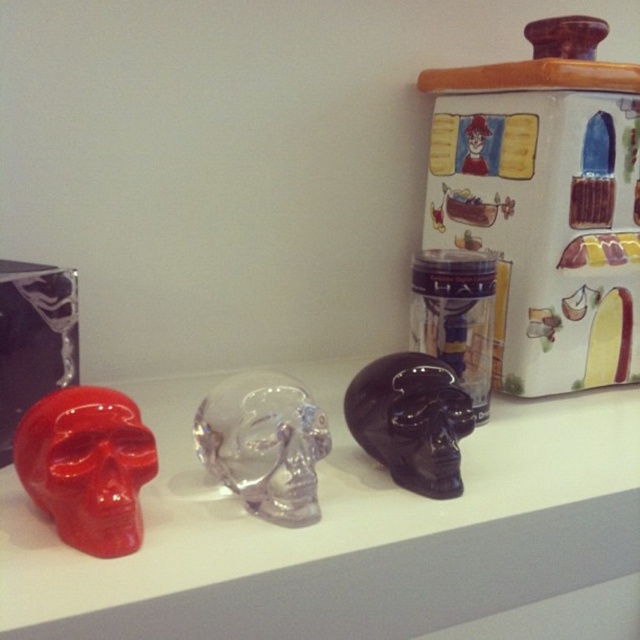
Does transparent glass skull at center have a lesser height compared to glossy black skull at center?

Yes, transparent glass skull at center is shorter than glossy black skull at center.

Does point (250, 384) lie behind point (428, 412)?

No, it is in front of (428, 412).

Where is `transparent glass skull at center`? transparent glass skull at center is located at coordinates (264, 444).

Does point (424, 621) come behind point (444, 445)?

That is False.

Does matte glass skull at center have a larger size compared to glossy black skull at center?

Yes, matte glass skull at center is bigger than glossy black skull at center.

Who is more forward, (x=4, y=556) or (x=372, y=422)?

Positioned in front is point (x=4, y=556).

Identify the location of matte glass skull at center. This screenshot has height=640, width=640. (342, 532).

Can you confirm if matte ceramic jar at upper right is positioned above transparent glass skull at center?

Yes.

How much distance is there between matte ceramic jar at upper right and transparent glass skull at center?

matte ceramic jar at upper right is 18.14 inches away from transparent glass skull at center.

The image size is (640, 640). Find the location of `matte ceramic jar at upper right`. matte ceramic jar at upper right is located at coordinates (545, 204).

Identify the location of matte ceramic jar at upper right. The height and width of the screenshot is (640, 640). (545, 204).